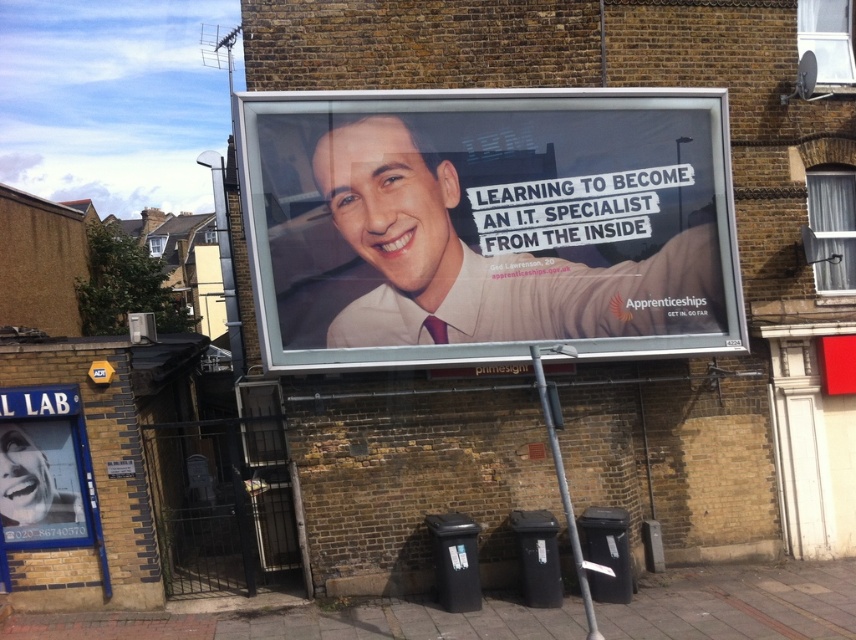
Based on the photo, can you confirm if white glossy billboard at center is positioned above white glossy poster at lower left?

Indeed, white glossy billboard at center is positioned over white glossy poster at lower left.

Does white glossy billboard at center come behind white glossy poster at lower left?

No, it is in front of white glossy poster at lower left.

You are a GUI agent. You are given a task and a screenshot of the screen. Output one action in this format:
    pyautogui.click(x=<x>, y=<y>)
    Task: Click on the white glossy billboard at center
    
    Given the screenshot: What is the action you would take?
    pyautogui.click(x=486, y=225)